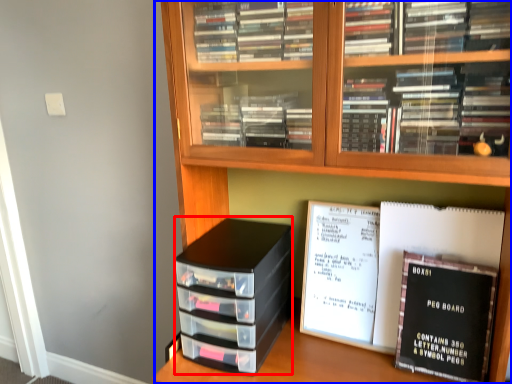
Question: Which of the following is the closest to the observer, stack (highlighted by a red box) or bookcase (highlighted by a blue box)?

Choices:
 (A) stack
 (B) bookcase

Answer: (B)